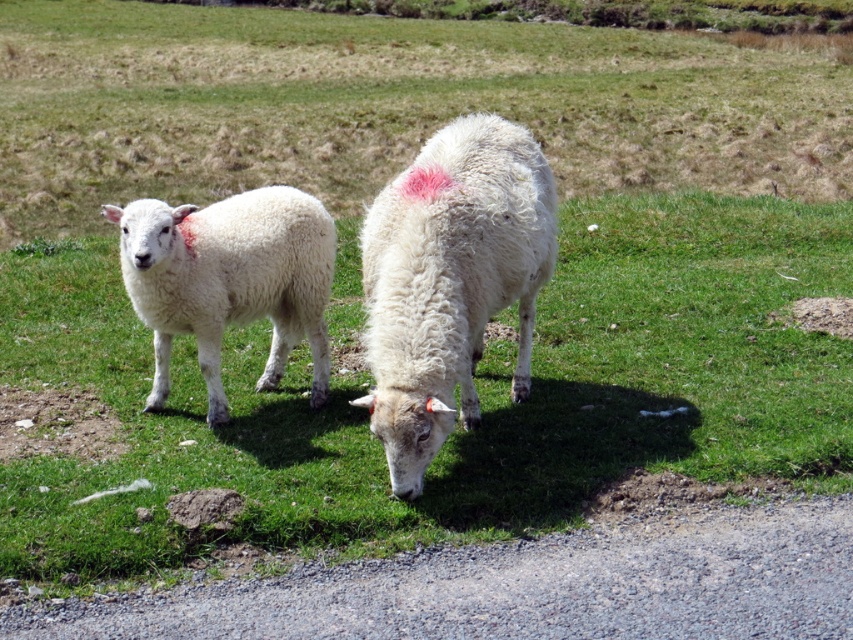
Between white woolen sheep at center and white woolen lamb at left, which one is positioned higher?

white woolen lamb at left is above.

Which is more to the right, white woolen sheep at center or white woolen lamb at left?

Positioned to the right is white woolen sheep at center.

Locate an element on the screen. This screenshot has height=640, width=853. white woolen sheep at center is located at coordinates (450, 280).